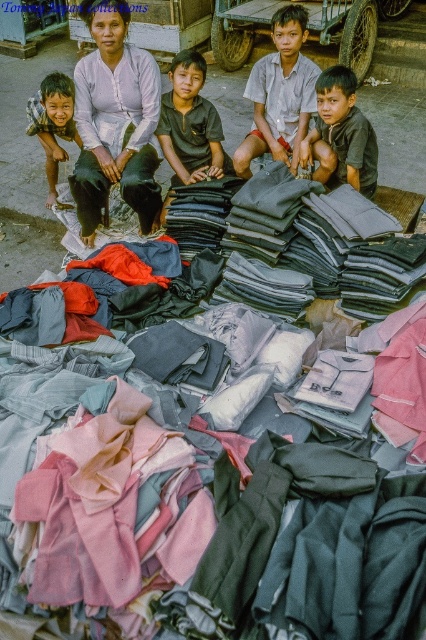
Between dark brown cotton shirt at center and dark gray cotton shirt at center, which one appears on the right side from the viewer's perspective?

Positioned to the right is dark brown cotton shirt at center.

Who is more forward, (336, 67) or (227, 161)?

Point (336, 67) is in front.

Measure the distance between point (331, 154) and camera.

A distance of 14.77 feet exists between point (331, 154) and camera.

At what (x,y) coordinates should I click in order to perform the action: click on dark brown cotton shirt at center. Please return your answer as a coordinate pair (x, y). This screenshot has height=640, width=426. Looking at the image, I should click on (340, 134).

Which is below, white cotton shirt at center or dark brown cotton shirt at center?

dark brown cotton shirt at center

Does point (279, 33) lie in front of point (319, 122)?

No, it is not.

Where is `white cotton shirt at center`? The image size is (426, 640). white cotton shirt at center is located at coordinates (279, 93).

Who is more forward, (152,118) or (353,140)?

Point (353,140)

Identify the location of matte white blouse at center. (115, 120).